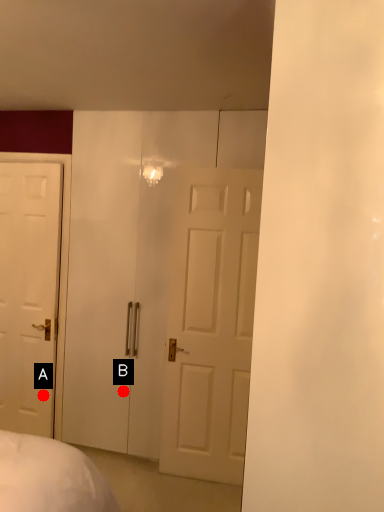
Question: Two points are circled on the image, labeled by A and B beside each circle. Which point is further to the camera?

Choices:
 (A) A is further
 (B) B is further

Answer: (A)